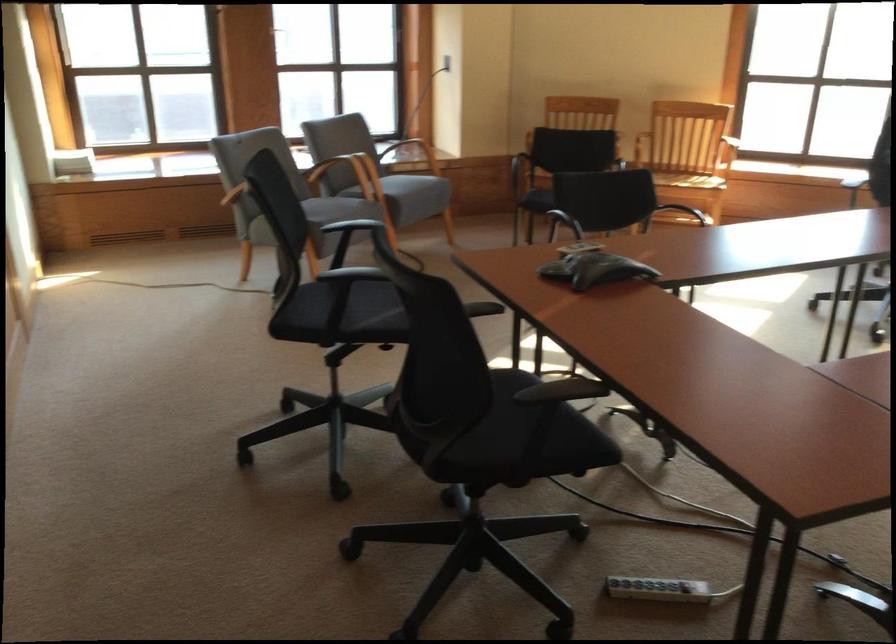
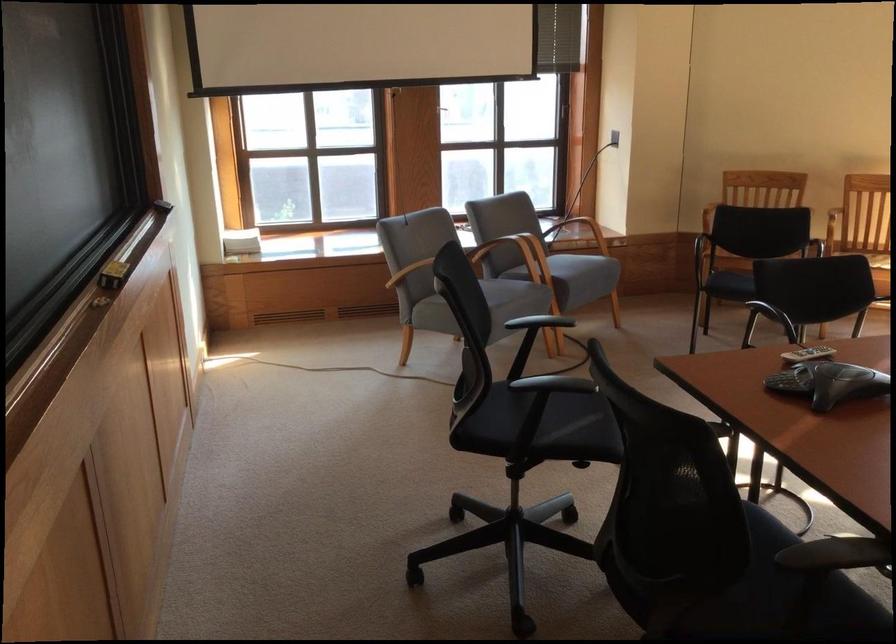
Question: The images are taken continuously from a first-person perspective. In which direction is your viewpoint rotating?

Choices:
 (A) Left
 (B) Right
 (C) Up
 (D) Down

Answer: (A)